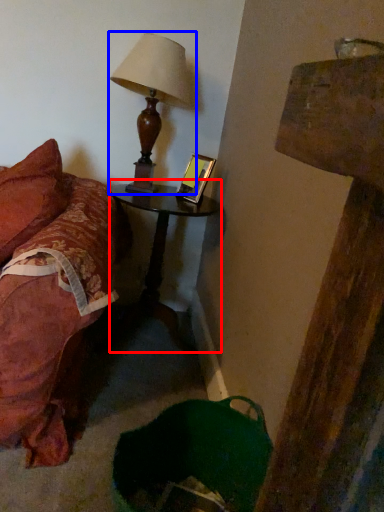
Question: Among these objects, which one is farthest to the camera, nightstand (highlighted by a red box) or lamp (highlighted by a blue box)?

Choices:
 (A) nightstand
 (B) lamp

Answer: (A)